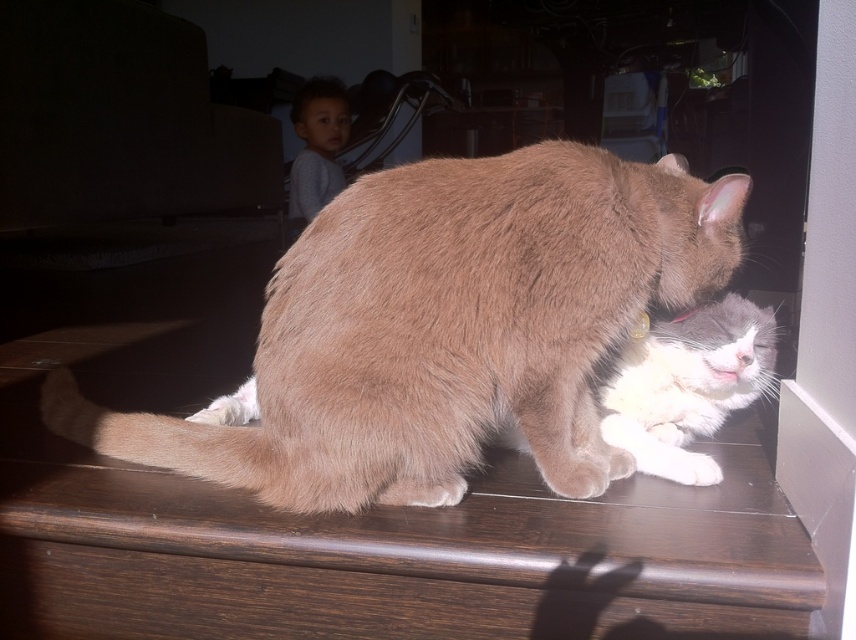
Is light brown fur cat at center smaller than white fluffy cat at lower right?

Actually, light brown fur cat at center might be larger than white fluffy cat at lower right.

Between light brown fur cat at center and white fluffy cat at lower right, which one is positioned higher?

light brown fur cat at center

The height and width of the screenshot is (640, 856). Describe the element at coordinates (444, 328) in the screenshot. I see `light brown fur cat at center` at that location.

Identify the location of light brown fur cat at center. The width and height of the screenshot is (856, 640). (444, 328).